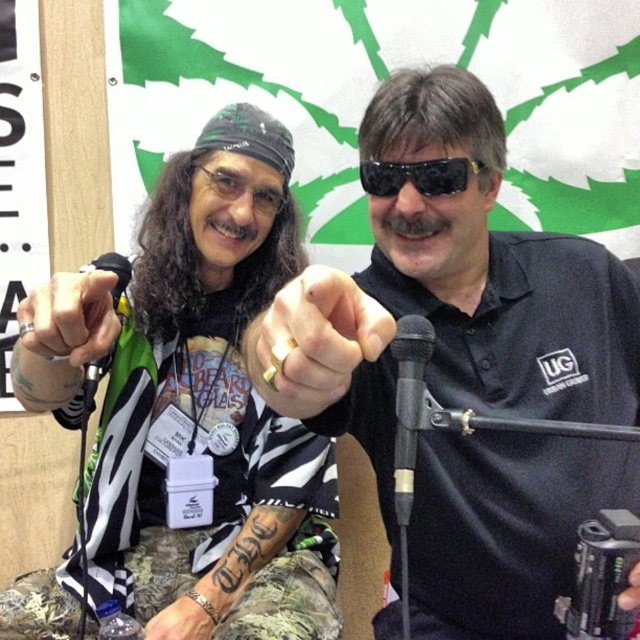
Does black plastic sunglasses at center appear under camouflage-patterned hand at lower left?

Incorrect, black plastic sunglasses at center is not positioned below camouflage-patterned hand at lower left.

Where is `black plastic sunglasses at center`? black plastic sunglasses at center is located at coordinates point(419,176).

Locate an element on the screen. The image size is (640, 640). black plastic sunglasses at center is located at coordinates (419, 176).

Between point (460, 634) and point (202, 618), which one is positioned behind?

The point (202, 618) is behind.

Who is positioned more to the left, black matte sunglasses at center or camouflage-patterned hand at lower left?

camouflage-patterned hand at lower left is more to the left.

Is point (609, 280) closer to viewer compared to point (186, 628)?

Yes, point (609, 280) is in front of point (186, 628).

Image resolution: width=640 pixels, height=640 pixels. Find the location of `black matte sunglasses at center`. black matte sunglasses at center is located at coordinates (449, 296).

Can you confirm if black matte finger at center is taller than black plastic sunglasses at center?

Indeed, black matte finger at center has a greater height compared to black plastic sunglasses at center.

Between black matte finger at center and black plastic sunglasses at center, which one is positioned higher?

black plastic sunglasses at center is higher up.

At what (x,y) coordinates should I click in order to perform the action: click on black matte finger at center. Please return your answer as a coordinate pair (x, y). The image size is (640, 640). Looking at the image, I should click on (67, 321).